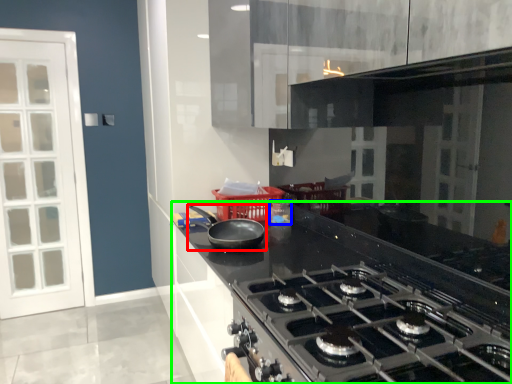
Question: Which object is positioned closest to kitchen appliance (highlighted by a red box)? Select from appliance (highlighted by a blue box) and countertop (highlighted by a green box).

Choices:
 (A) appliance
 (B) countertop

Answer: (A)